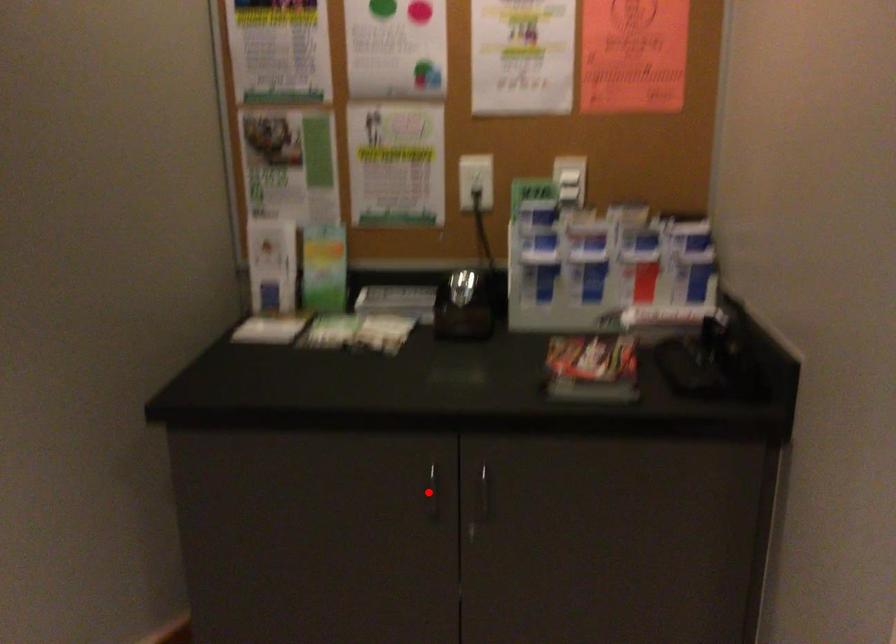
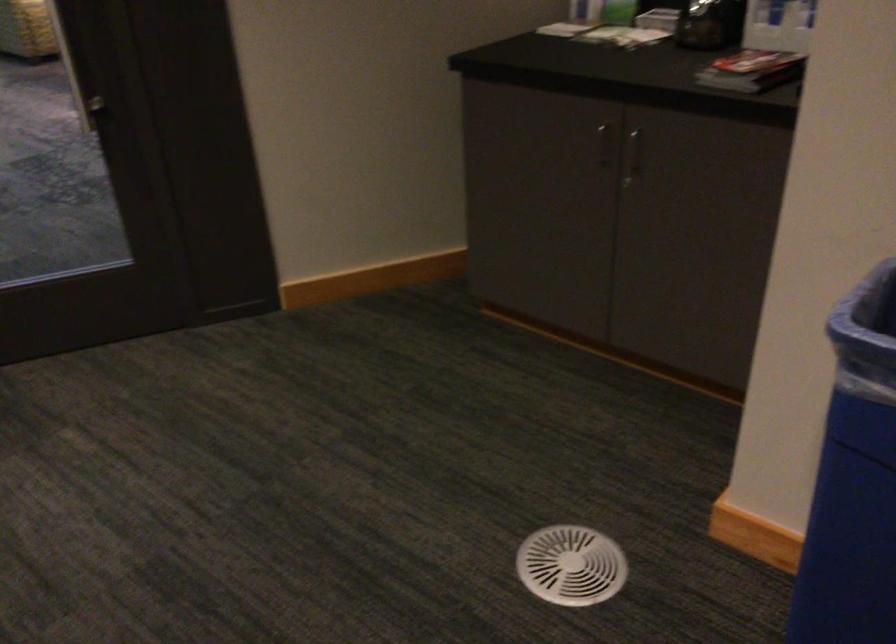
Question: I am providing you with two images of the same scene from different viewpoints. Given a red point in image1, look at the same physical point in image2. Is it:

Choices:
 (A) Closer to the viewpoint
 (B) Farther from the viewpoint

Answer: (B)